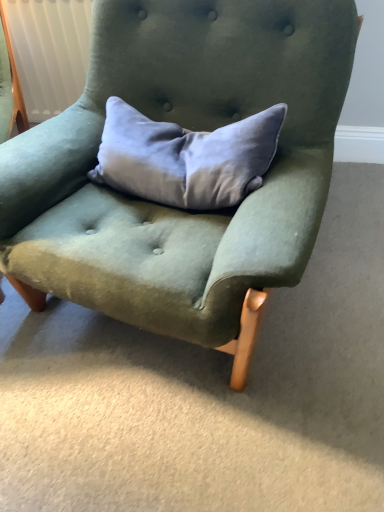
Question: From their relative heights in the image, would you say satin gray pillow at center is taller or shorter than velvet green armchair at center?

Choices:
 (A) short
 (B) tall

Answer: (A)

Question: In the image, is satin gray pillow at center positioned in front of or behind velvet green armchair at center?

Choices:
 (A) front
 (B) behind

Answer: (B)

Question: Is satin gray pillow at center to the left or to the right of velvet green armchair at center in the image?

Choices:
 (A) right
 (B) left

Answer: (A)

Question: From the image's perspective, is velvet green armchair at center positioned above or below satin gray pillow at center?

Choices:
 (A) below
 (B) above

Answer: (A)

Question: Is velvet green armchair at center taller or shorter than satin gray pillow at center?

Choices:
 (A) short
 (B) tall

Answer: (B)

Question: Is velvet green armchair at center bigger or smaller than satin gray pillow at center?

Choices:
 (A) small
 (B) big

Answer: (B)

Question: Is velvet green armchair at center to the left or to the right of satin gray pillow at center in the image?

Choices:
 (A) left
 (B) right

Answer: (A)